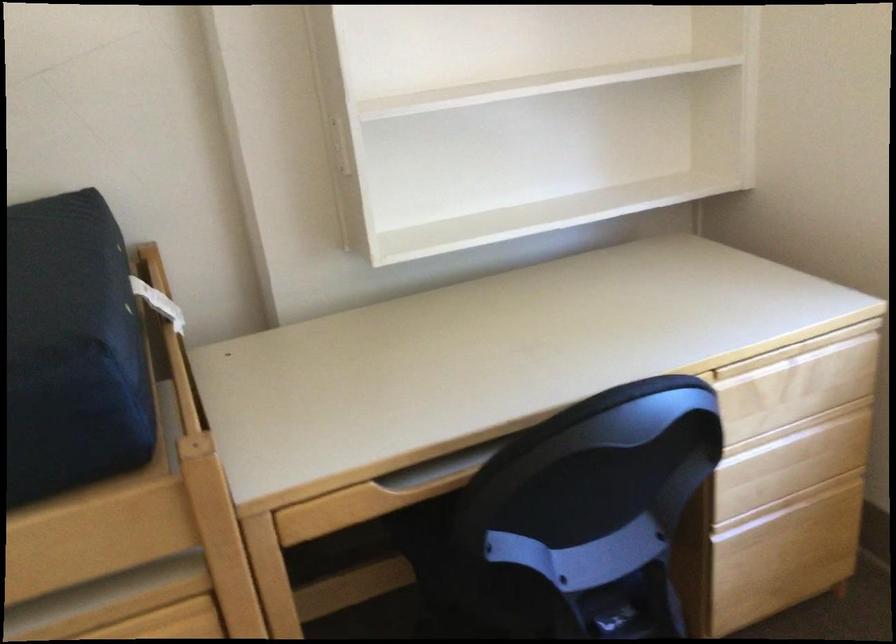
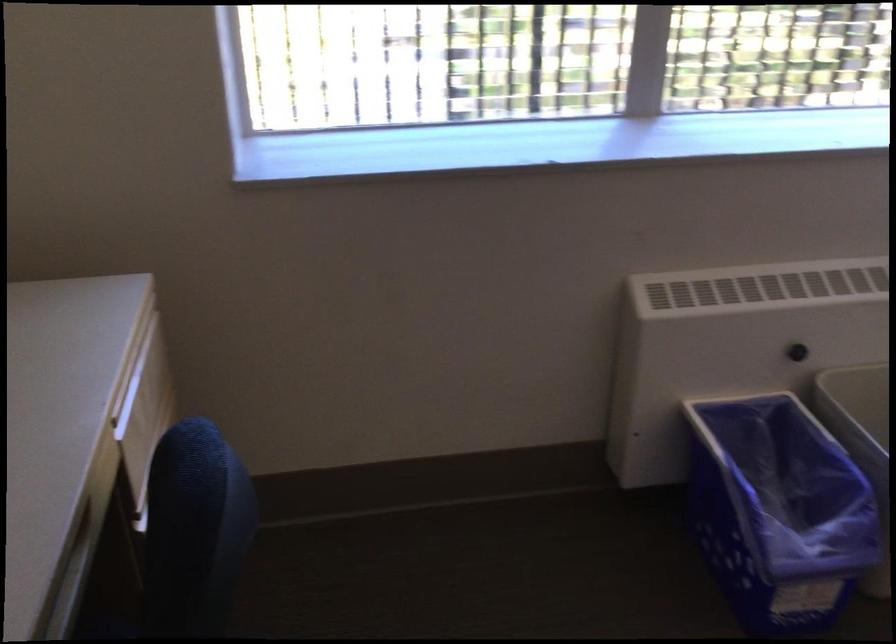
Question: I am providing you with two images of the same scene from different viewpoints. After the viewpoint changes to image2, which objects are now occluded?

Choices:
 (A) printer document feeder
 (B) black heater knob
 (C) blue recycling bin
 (D) drawer handle groove

Answer: (D)